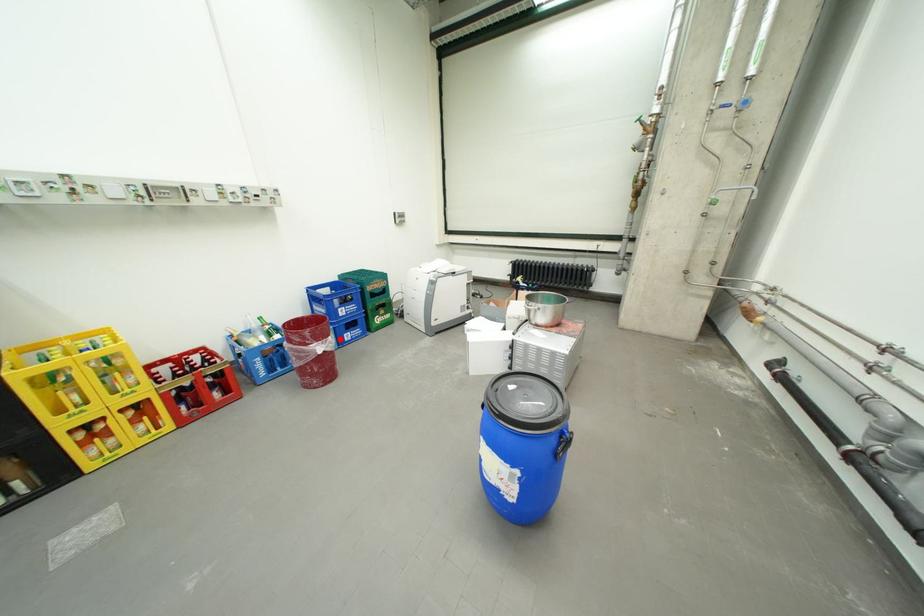
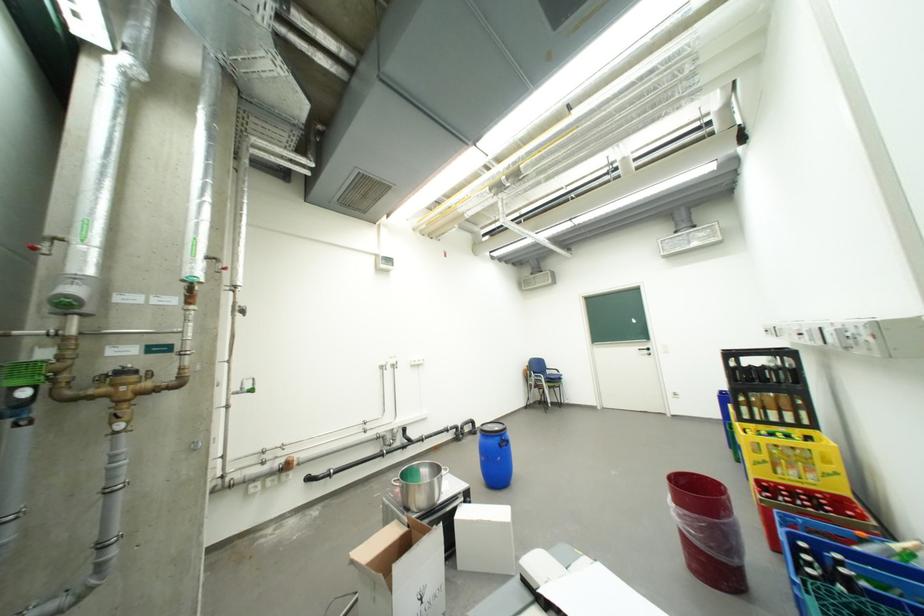
The point at the highlighted location is marked in the first image. Where is the corresponding point in the second image?

(685, 507)